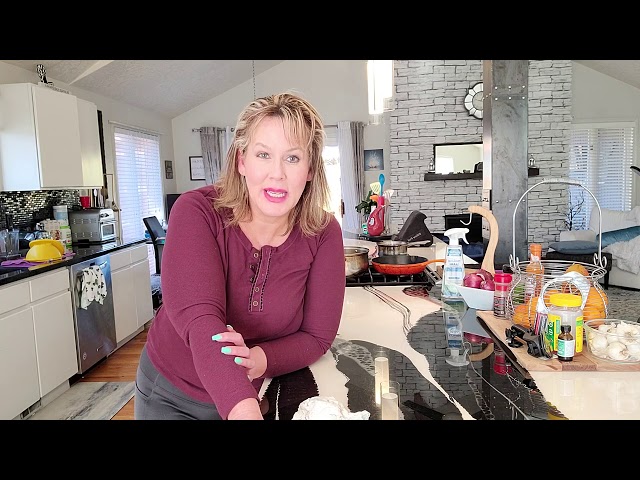
Identify the location of spray bottle. The width and height of the screenshot is (640, 480). (452, 284).